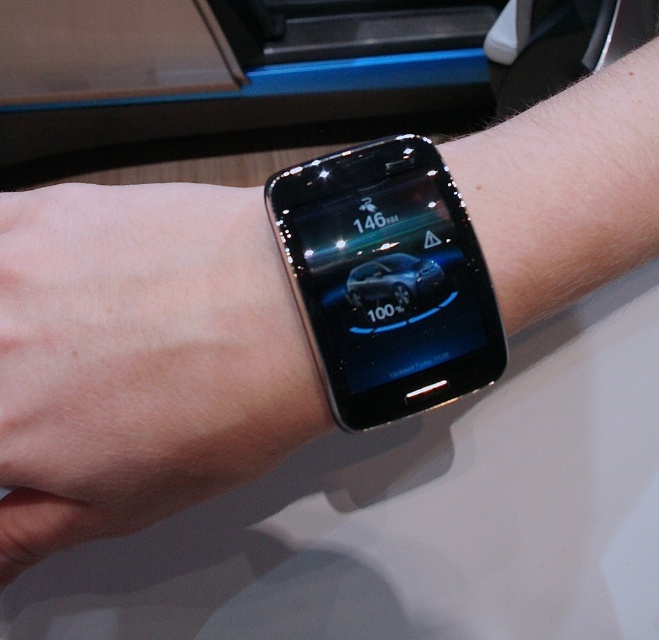
Question: Where is sleek black smartwatch at center located in relation to sleek metallic car at center in the image?

Choices:
 (A) above
 (B) below

Answer: (A)

Question: Which point appears farthest from the camera in this image?

Choices:
 (A) (364, 294)
 (B) (324, 163)
 (C) (86, 509)

Answer: (C)

Question: Which object is closer to the camera taking this photo?

Choices:
 (A) sleek metallic car at center
 (B) sleek black smartwatch at center

Answer: (B)

Question: In this image, where is satin gold watch at center located relative to sleek metallic car at center?

Choices:
 (A) above
 (B) below

Answer: (B)

Question: Which object appears farthest from the camera in this image?

Choices:
 (A) sleek black smartwatch at center
 (B) sleek metallic car at center

Answer: (B)

Question: Does sleek black smartwatch at center appear over sleek metallic car at center?

Choices:
 (A) yes
 (B) no

Answer: (A)